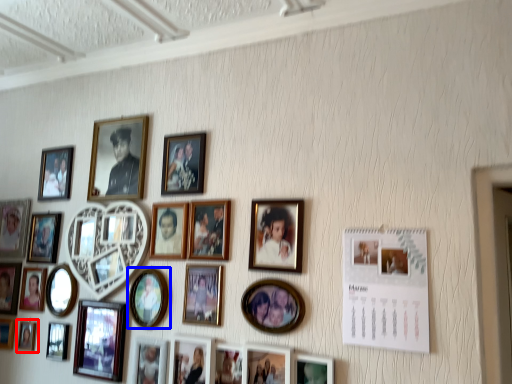
Question: Which of the following is the closest to the observer, picture frame (highlighted by a red box) or picture frame (highlighted by a blue box)?

Choices:
 (A) picture frame
 (B) picture frame

Answer: (B)